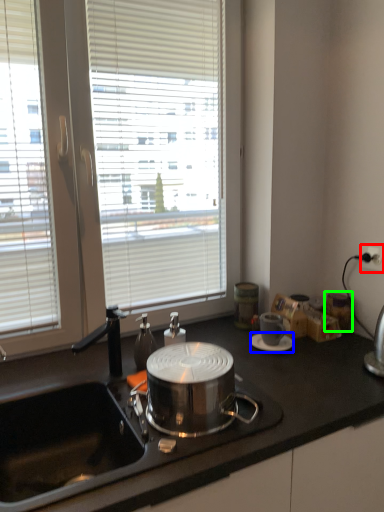
Question: Considering the real-world distances, which object is farthest from power outlet (highlighted by a red box)? saucer (highlighted by a blue box) or appliance (highlighted by a green box)?

Choices:
 (A) saucer
 (B) appliance

Answer: (A)